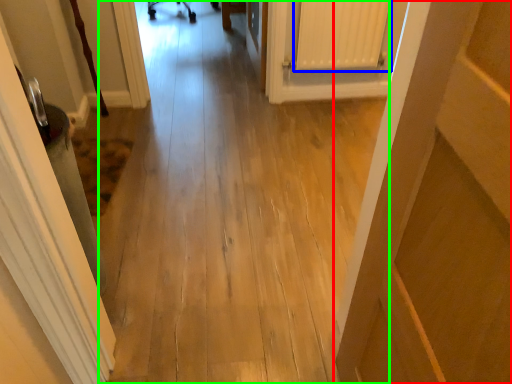
Question: Estimate the real-world distances between objects in this image. Which object is farther from door (highlighted by a red box), radiator (highlighted by a blue box) or path (highlighted by a green box)?

Choices:
 (A) radiator
 (B) path

Answer: (A)